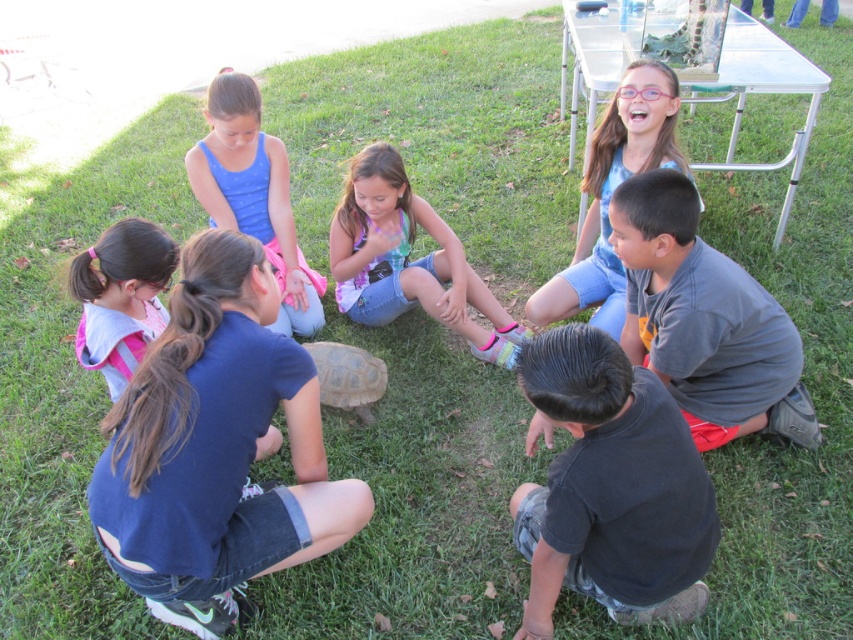
You are a photographer trying to capture a photo of the brown rough textured turtle at center. To get a clear shot, you need to ensure that the blue fabric shirt at upper left is not blocking the view. Based on their positions, can you determine if the turtle is to the right or left of the shirt?

The blue fabric shirt at upper left is to the left of the brown rough textured turtle at center, so the turtle is to the right of the shirt.

You are a photographer trying to capture the tortoise at the center of the image. There is a blue fabric shirt at upper left at point [253,193]. To ensure the tortoise is the main focus, should you adjust your camera angle to avoid the blue fabric shirt at upper left?

Yes, you should adjust your camera angle to avoid the blue fabric shirt at upper left because it is located at point [253,193], which is near the tortoise and may distract from the main subject.